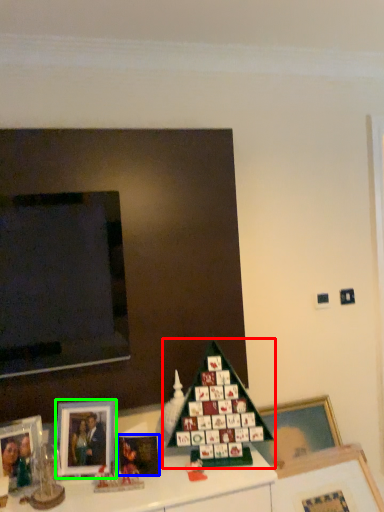
Question: Considering the real-world distances, which object is closest to christmas tree (highlighted by a red box)? picture frame (highlighted by a blue box) or picture frame (highlighted by a green box).

Choices:
 (A) picture frame
 (B) picture frame

Answer: (A)